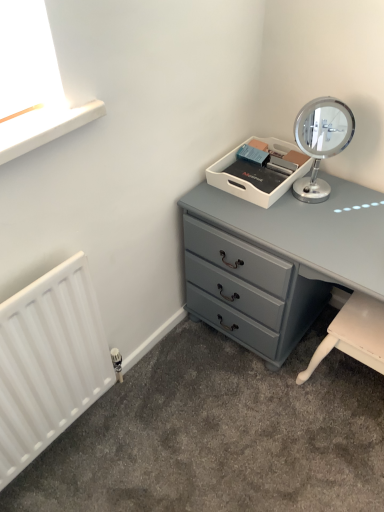
The image size is (384, 512). I want to click on free space in front of white matte radiator at lower left, so click(67, 482).